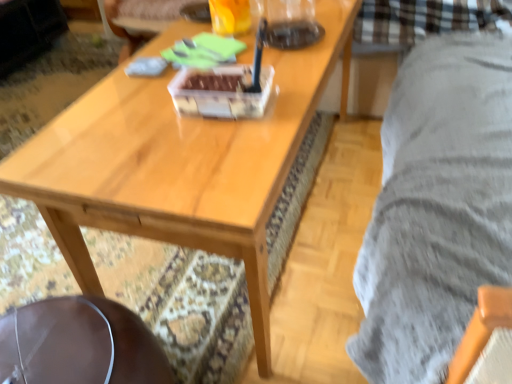
Identify the location of empty space that is ontop of brown leather swivel chair at lower left (from a real-world perspective). (61, 339).